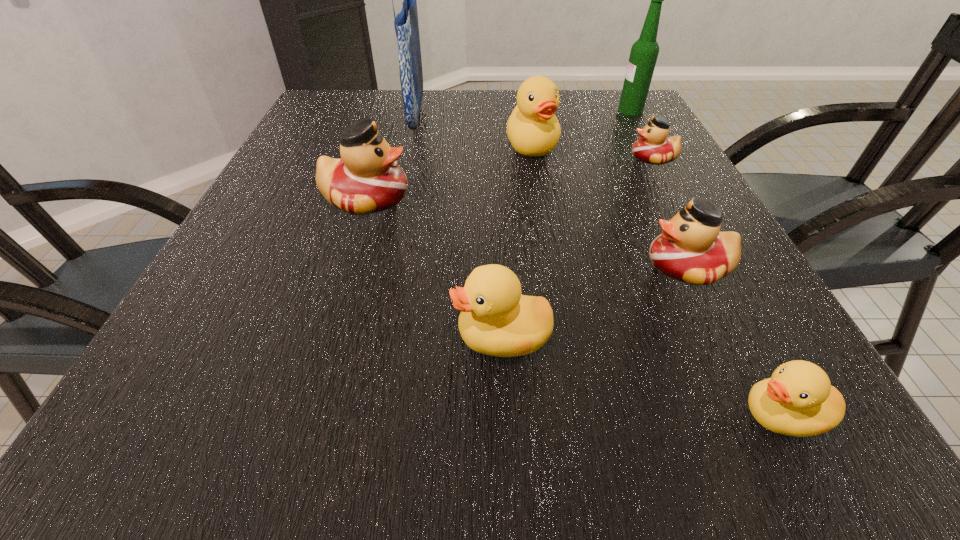
Where is `free space located 0.050m on the face of the third nearest object`? free space located 0.050m on the face of the third nearest object is located at coordinates (617, 267).

This screenshot has width=960, height=540. Find the location of `free location located on the face of the third nearest object`. free location located on the face of the third nearest object is located at coordinates (559, 267).

The image size is (960, 540). Identify the location of free spot located at the beak of the second nearest yellow duck. (393, 336).

Locate an element on the screen. Image resolution: width=960 pixels, height=540 pixels. free location located at the beak of the second nearest yellow duck is located at coordinates (252, 336).

Where is `free location located at the beak of the second nearest yellow duck`? free location located at the beak of the second nearest yellow duck is located at coordinates (319, 336).

At what (x,y) coordinates should I click in order to perform the action: click on free space located on the face of the smallest red duck. Please return your answer as a coordinate pair (x, y). Looking at the image, I should click on (535, 158).

Where is `blank space located on the face of the smallest red duck`? The height and width of the screenshot is (540, 960). blank space located on the face of the smallest red duck is located at coordinates (561, 158).

Find the location of a particular element. vacant region located on the face of the smallest red duck is located at coordinates (557, 158).

The image size is (960, 540). What are the coordinates of `free space located at the beak of the rightmost yellow duck` in the screenshot? It's located at (584, 415).

Find the location of a particular element. Image resolution: width=960 pixels, height=540 pixels. free spot located 0.300m at the beak of the rightmost yellow duck is located at coordinates (506, 415).